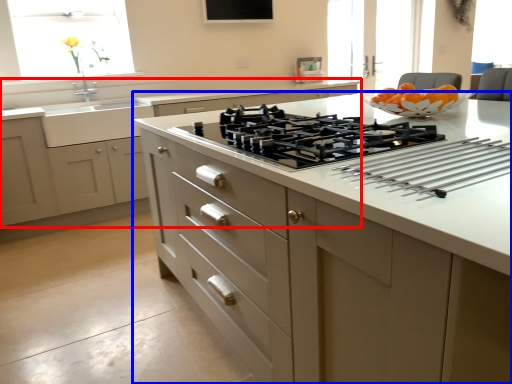
Question: Which point is further to the camera, cabinetry (highlighted by a red box) or countertop (highlighted by a blue box)?

Choices:
 (A) cabinetry
 (B) countertop

Answer: (A)